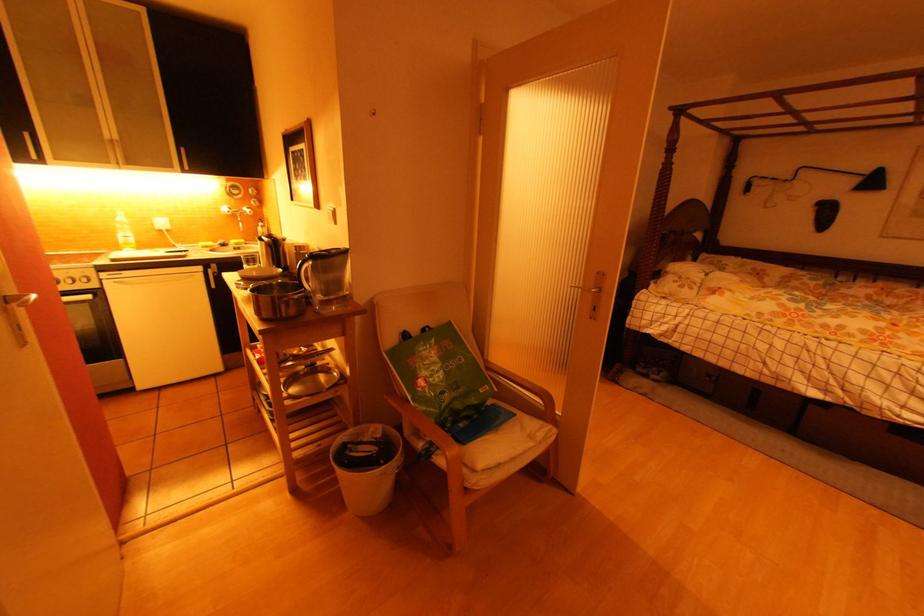
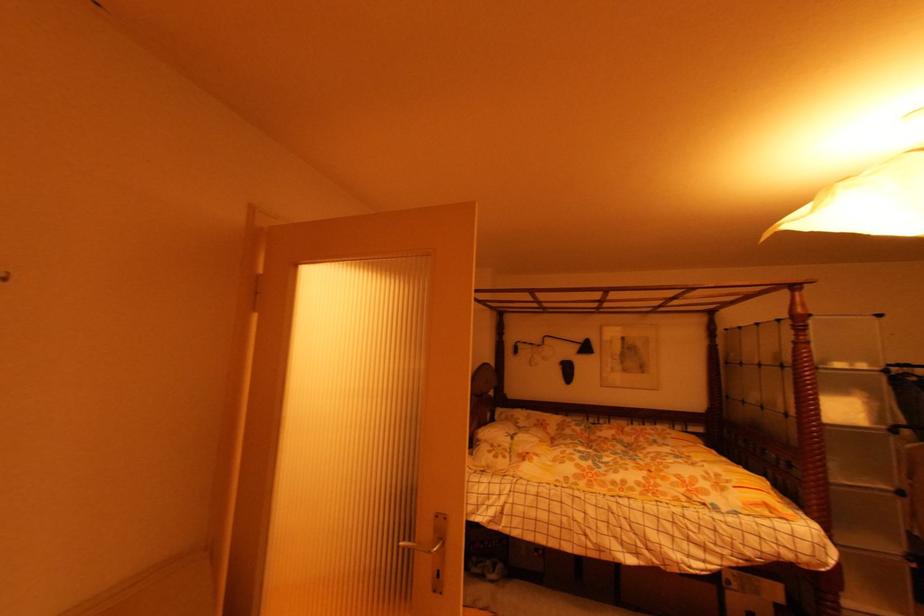
First-person continuous shooting, in which direction is the camera rotating?

The camera rotated toward right-up.